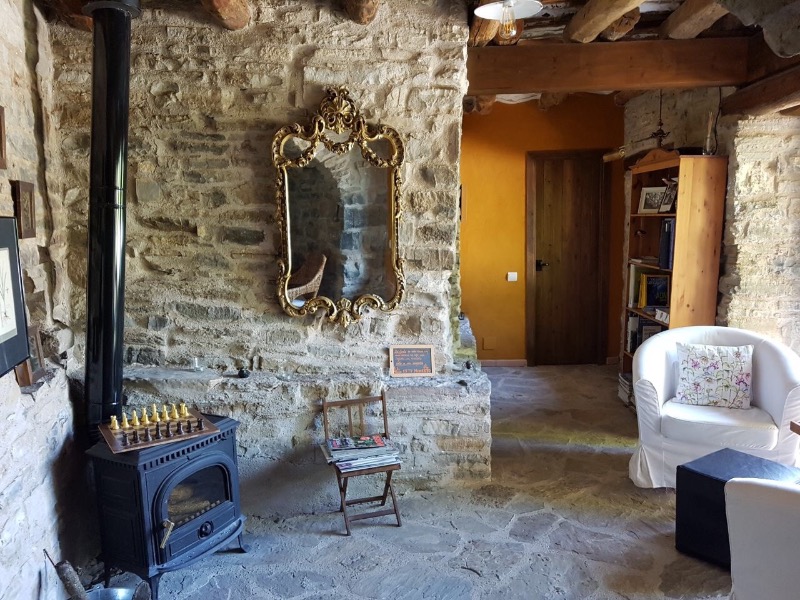
This screenshot has height=600, width=800. I want to click on flower print pillow, so click(x=714, y=381).